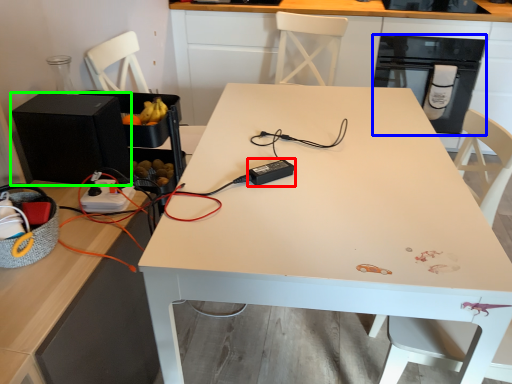
Question: Which object is positioned farthest from appliance (highlighted by a red box)? Select from dish washer (highlighted by a blue box) and appliance (highlighted by a green box).

Choices:
 (A) dish washer
 (B) appliance

Answer: (A)